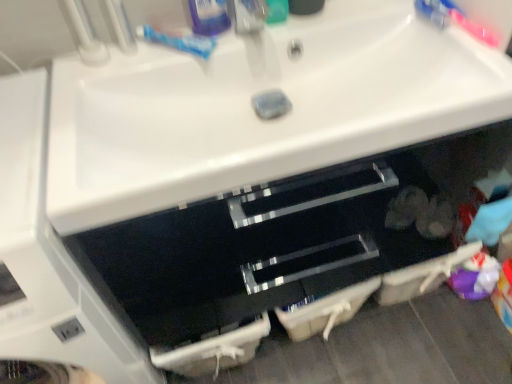
Where is `vacant area that lies between blue matte toothpaste at upper center and green plastic toothpaste tube at upper center, the 1th toiletry in the right-to-left sequence`? This screenshot has width=512, height=384. vacant area that lies between blue matte toothpaste at upper center and green plastic toothpaste tube at upper center, the 1th toiletry in the right-to-left sequence is located at coordinates (240, 38).